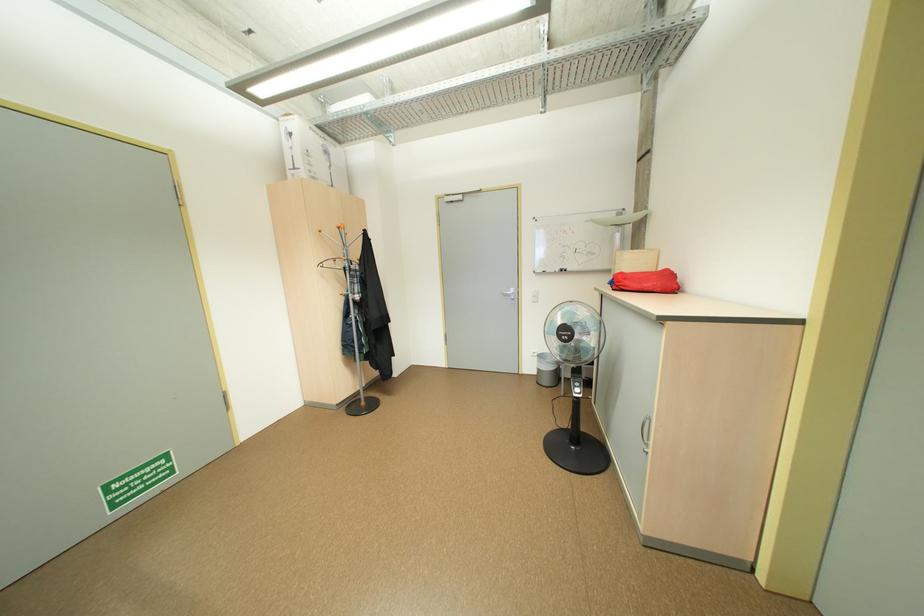
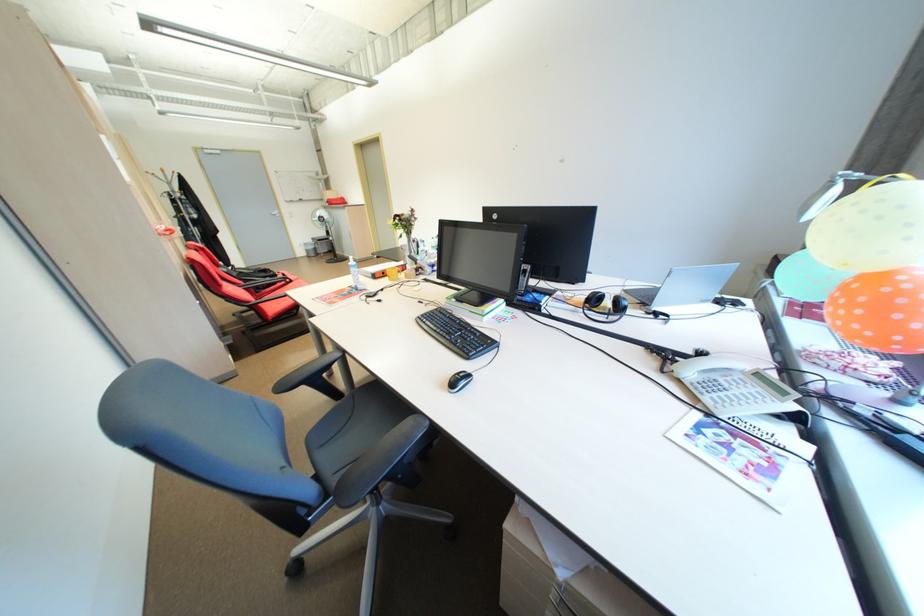
Find the pixel in the second image that matches point (548, 371) in the first image.

(315, 252)